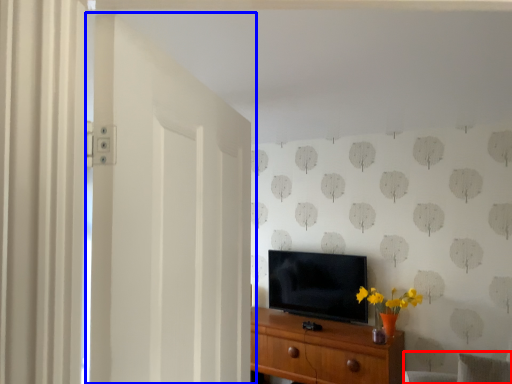
Question: Which object is further to the camera taking this photo, swivel chair (highlighted by a red box) or door (highlighted by a blue box)?

Choices:
 (A) swivel chair
 (B) door

Answer: (A)